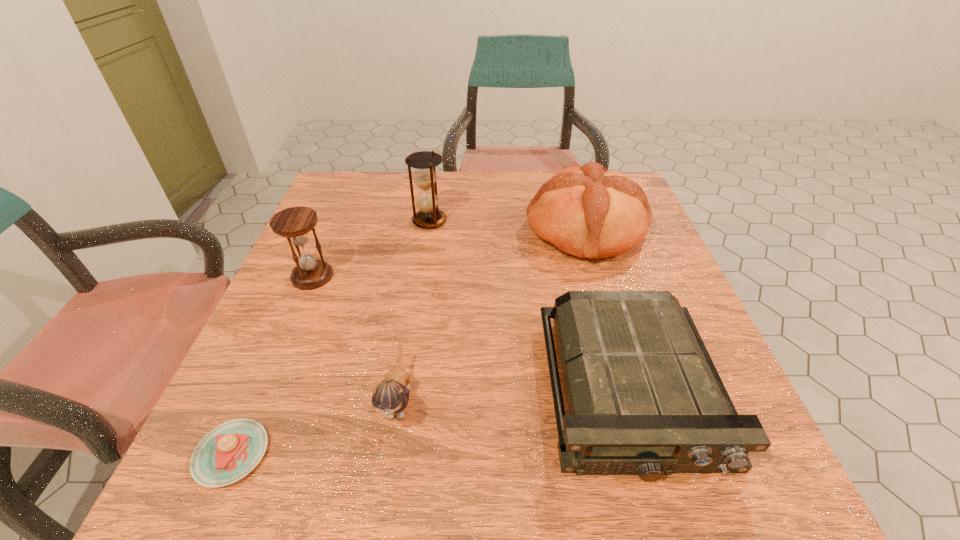
You are a GUI agent. You are given a task and a screenshot of the screen. Output one action in this format:
    pyautogui.click(x=<x>, y=<y>)
    Task: Click on the vacant space in between the right hourglass and the shortest object
    This screenshot has height=540, width=960.
    Given the screenshot: What is the action you would take?
    pyautogui.click(x=330, y=337)

You are a GUI agent. You are given a task and a screenshot of the screen. Output one action in this format:
    pyautogui.click(x=<x>, y=<y>)
    Task: Click on the unoccupied position between the shorter hourglass and the bread
    
    Given the screenshot: What is the action you would take?
    pyautogui.click(x=449, y=253)

Locate an element on the screen. The width and height of the screenshot is (960, 540). free space that is in between the third shortest object and the bread is located at coordinates (492, 314).

Where is `free space between the shortest object and the shorter hourglass`? This screenshot has height=540, width=960. free space between the shortest object and the shorter hourglass is located at coordinates (272, 365).

I want to click on unoccupied area between the third shortest object and the radio receiver, so click(x=515, y=395).

This screenshot has height=540, width=960. In order to click on free point between the farther hourglass and the radio receiver in this screenshot , I will do `click(530, 306)`.

Identify the location of object that can be found as the closest to the kitten. Image resolution: width=960 pixels, height=540 pixels. (229, 452).

The height and width of the screenshot is (540, 960). I want to click on object that can be found as the fourth closest to the kitten, so click(587, 211).

This screenshot has height=540, width=960. I want to click on free point that satisfies the following two spatial constraints: 1. on the back side of the bread; 2. on the right side of the pastry, so click(328, 230).

Identify the location of free space that satisfies the following two spatial constraints: 1. on the back side of the left hourglass; 2. on the left side of the pastry. The image size is (960, 540). (308, 276).